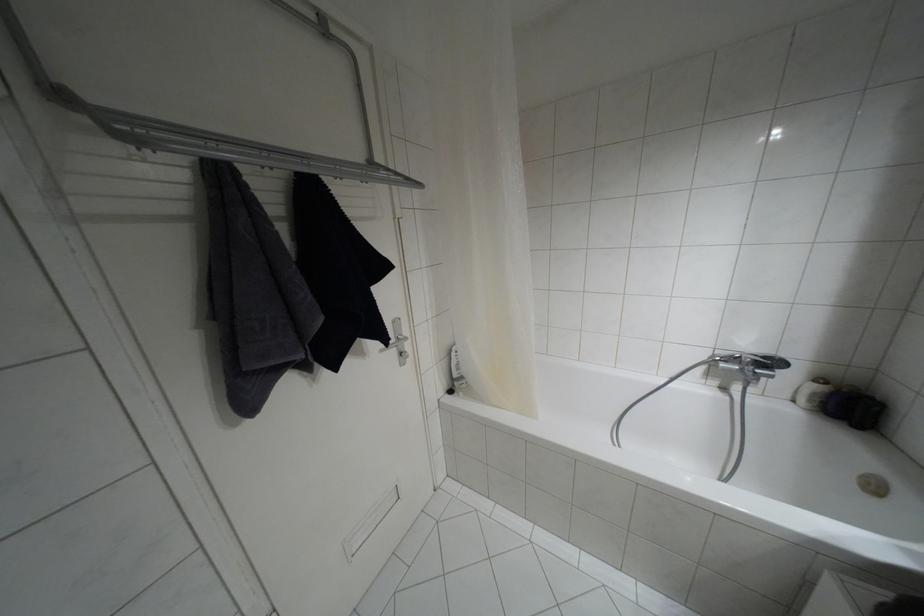
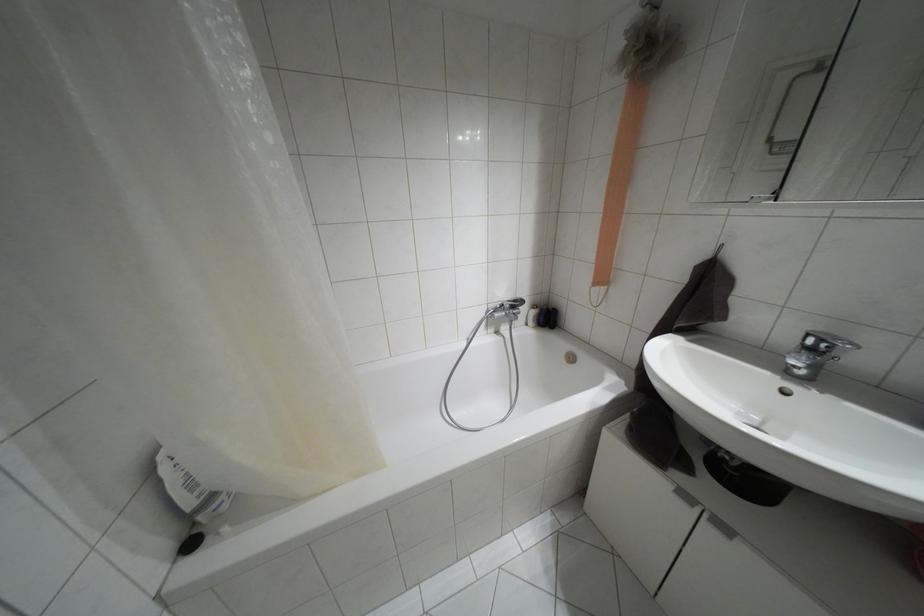
Question: The camera is either moving clockwise (left) or counter-clockwise (right) around the object. The first image is from the beginning of the video and the second image is from the end. Is the camera moving left or right when shooting the video?

Choices:
 (A) Left
 (B) Right

Answer: (A)